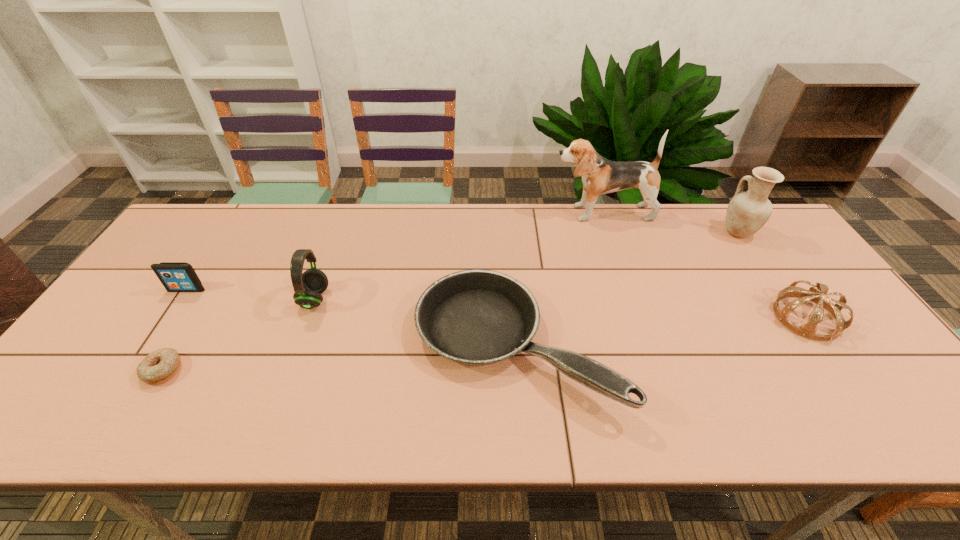
Locate an element on the screen. The height and width of the screenshot is (540, 960). vacant space that satisfies the following two spatial constraints: 1. at the face of the tiara; 2. on the right side of the puppy is located at coordinates (637, 318).